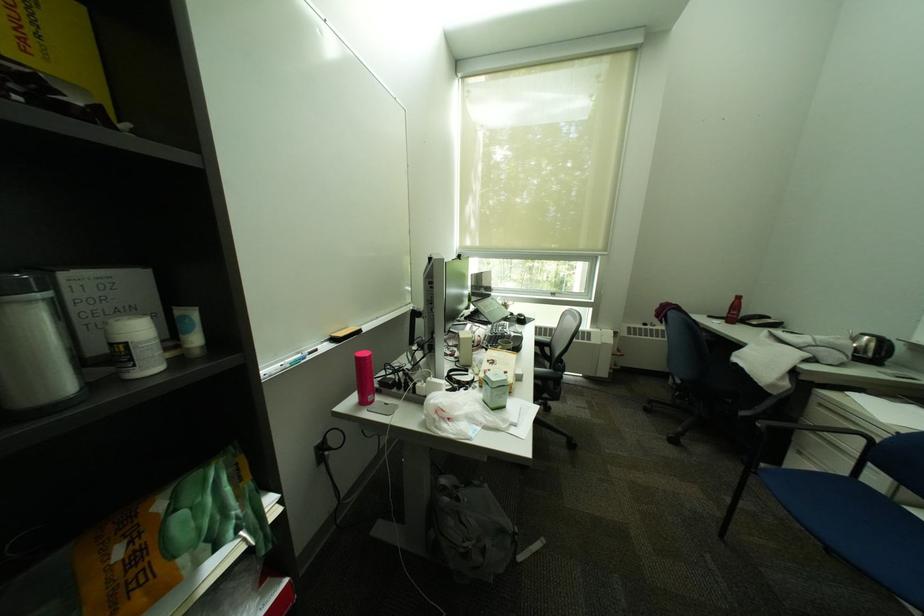
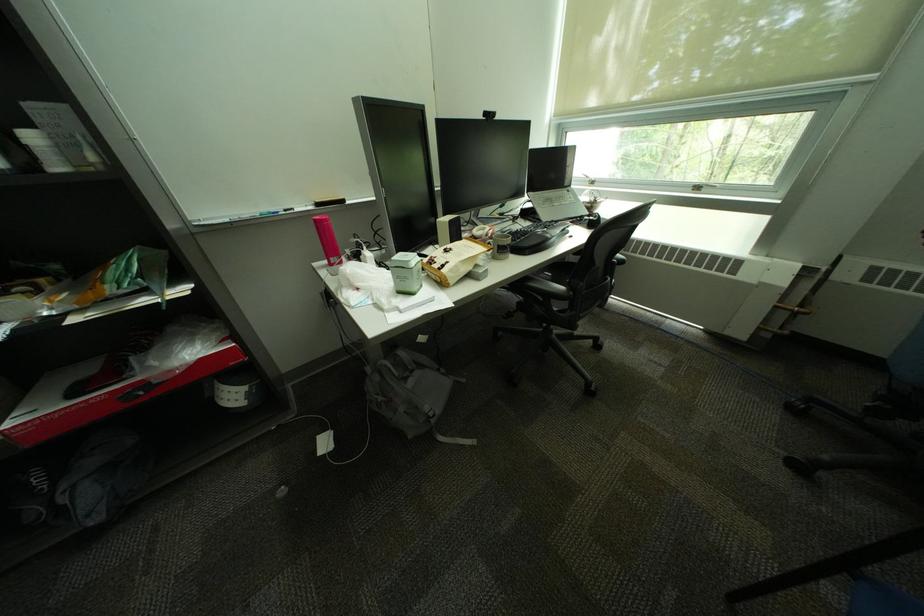
Based on the continuous images, in which direction is the camera rotating?

The camera rotated toward left-down.